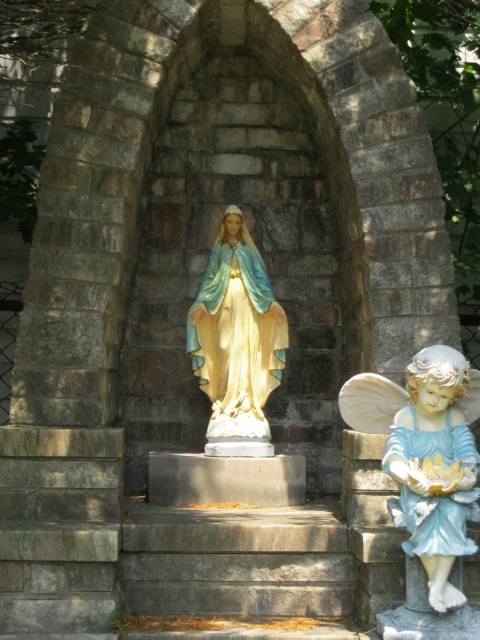
You are a tour guide explaining the statues in the archway to visitors. You mention both the porcelain angel at right and the matte gold statue at center. Which statue is bigger?

The porcelain angel at right is larger in size compared to the matte gold statue at center.